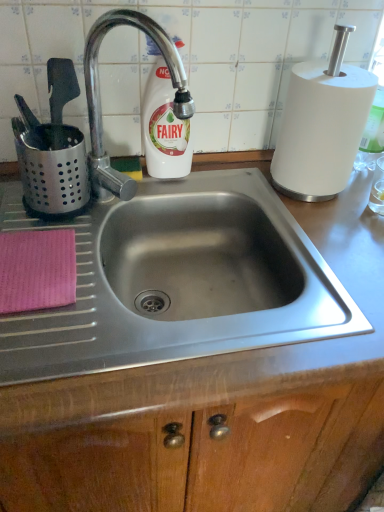
The width and height of the screenshot is (384, 512). Find the location of `free spot in front of pink woven cloth at lower left`. free spot in front of pink woven cloth at lower left is located at coordinates (48, 345).